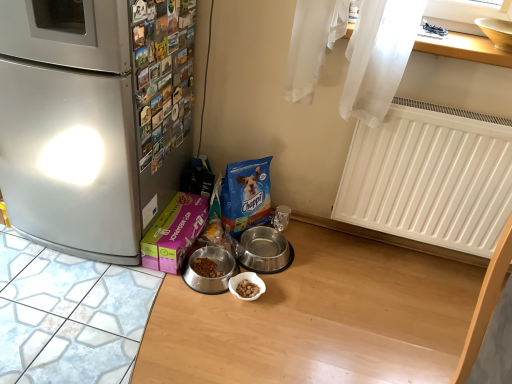
Question: Does wooden at upper right have a larger size compared to pink matte box at lower left?

Choices:
 (A) yes
 (B) no

Answer: (B)

Question: Is wooden at upper right positioned far away from pink matte box at lower left?

Choices:
 (A) yes
 (B) no

Answer: (A)

Question: Would you say wooden at upper right is outside pink matte box at lower left?

Choices:
 (A) yes
 (B) no

Answer: (A)

Question: Is the surface of wooden at upper right in direct contact with pink matte box at lower left?

Choices:
 (A) yes
 (B) no

Answer: (B)

Question: Is wooden at upper right behind pink matte box at lower left?

Choices:
 (A) no
 (B) yes

Answer: (A)

Question: Does wooden at upper right have a lesser height compared to pink matte box at lower left?

Choices:
 (A) no
 (B) yes

Answer: (B)

Question: Considering the relative sizes of pink matte box at lower left and wooden at upper right in the image provided, is pink matte box at lower left wider than wooden at upper right?

Choices:
 (A) no
 (B) yes

Answer: (A)

Question: Can you confirm if pink matte box at lower left is bigger than wooden at upper right?

Choices:
 (A) yes
 (B) no

Answer: (A)

Question: Is pink matte box at lower left further to the viewer compared to wooden at upper right?

Choices:
 (A) yes
 (B) no

Answer: (A)

Question: Is pink matte box at lower left oriented away from wooden at upper right?

Choices:
 (A) yes
 (B) no

Answer: (B)

Question: Can you confirm if pink matte box at lower left is positioned to the right of wooden at upper right?

Choices:
 (A) no
 (B) yes

Answer: (A)

Question: Can you confirm if pink matte box at lower left is thinner than wooden at upper right?

Choices:
 (A) no
 (B) yes

Answer: (B)

Question: Is pink matte box at lower left located outside metallic stainless steel bowl at center, which is the 1th appliance in left-to-right order?

Choices:
 (A) no
 (B) yes

Answer: (B)